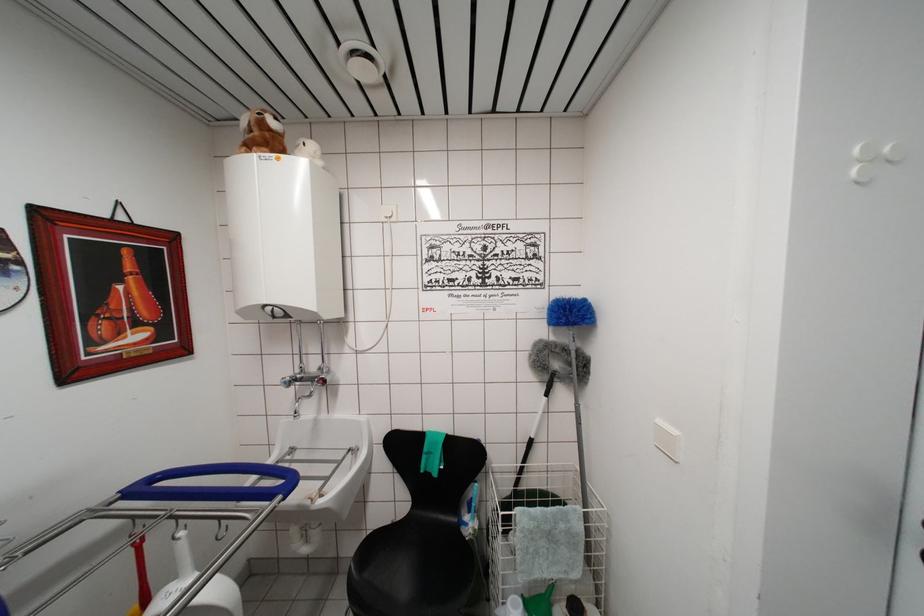
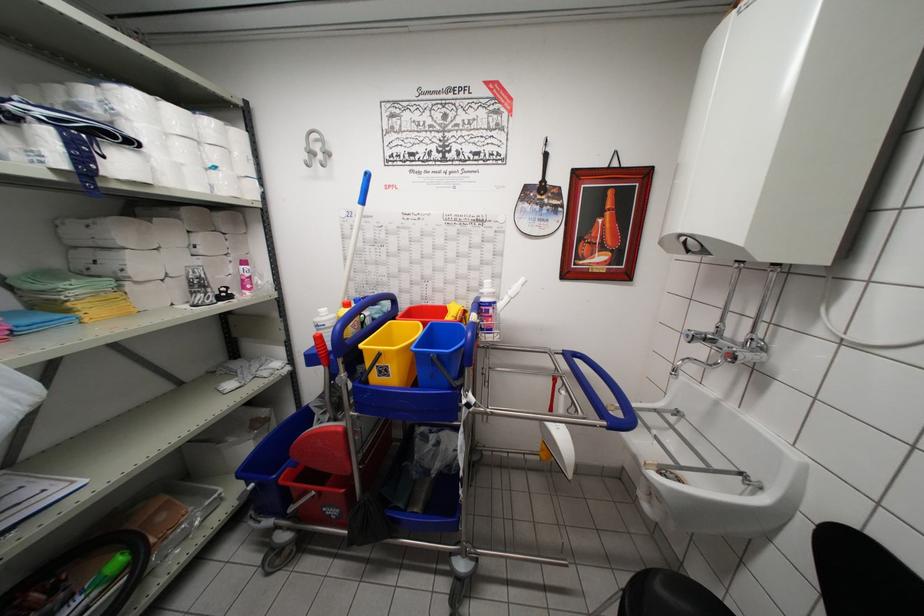
First-person continuous shooting, in which direction is the camera rotating?

The rotation direction of the camera is left-down.